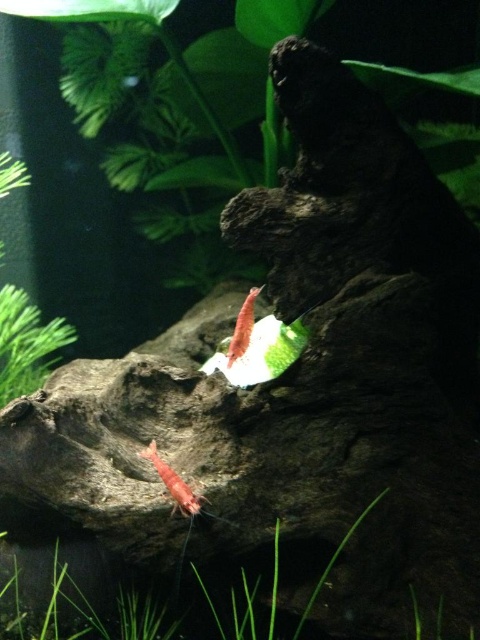
You are an aquatic plant installer working in the aquarium. You need to place a new plant between the two points labeled point (231,372) and point (239,316). Which point should the plant be closer to in order to ensure it is placed in front of the driftwood?

The plant should be placed closer to point (231,372) because it is further to the viewer than point (239,316), so positioning the plant near this point would place it in front of the driftwood.